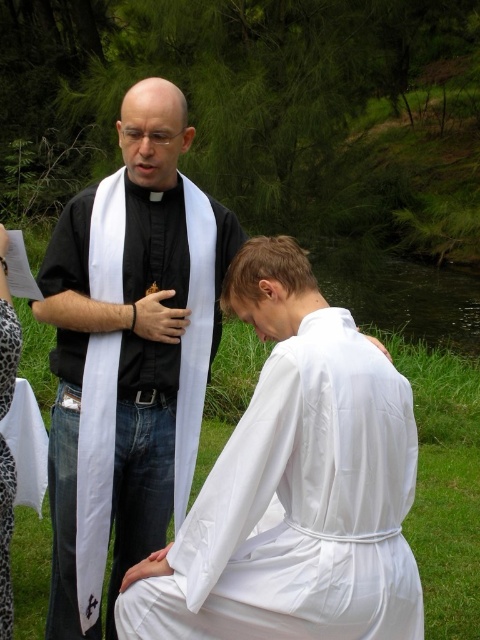
You are a photographer trying to capture a closeup of both point (157, 120) and point (2, 596) in the scene. Since you can only focus on one point at a time, which point should you choose to ensure the other is also in focus?

You should focus on point (157, 120) because it is closer to the viewer than point (2, 596). This way, the depth of field will include the farther point in focus as well.

You are organizing a religious ceremony and need to arrange seating for participants. Given the white cotton robe at lower center and the black matte vestment at center, which one requires more physical space to accommodate?

The black matte vestment at center requires more physical space to accommodate because it occupies more space than the white cotton robe at lower center.